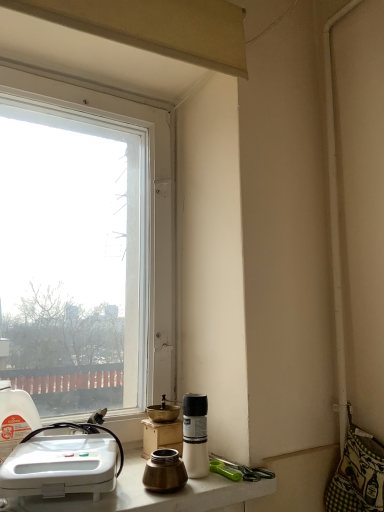
Question: From the image's perspective, is transparent glass window at upper left located above or below white matte bottle at lower center, positioned as the second bottle in left-to-right order?

Choices:
 (A) above
 (B) below

Answer: (A)

Question: From a real-world perspective, is transparent glass window at upper left positioned above or below white matte bottle at lower center, positioned as the second bottle in left-to-right order?

Choices:
 (A) above
 (B) below

Answer: (A)

Question: Which object is the farthest from the white plastic sink at lower left?

Choices:
 (A) white glossy countertop at lower center
 (B) gold matte grinder at center
 (C) translucent plastic bottle at left, marked as the first bottle in a left-to-right arrangement
 (D) brass metallic coffee cup at lower center
 (E) transparent glass window at upper left

Answer: (E)

Question: Which object is positioned farthest from the brass metallic coffee cup at lower center?

Choices:
 (A) white matte bottle at lower center, positioned as the second bottle in left-to-right order
 (B) white plastic sink at lower left
 (C) translucent plastic bottle at left, marked as the first bottle in a left-to-right arrangement
 (D) white glossy countertop at lower center
 (E) gold matte grinder at center

Answer: (C)